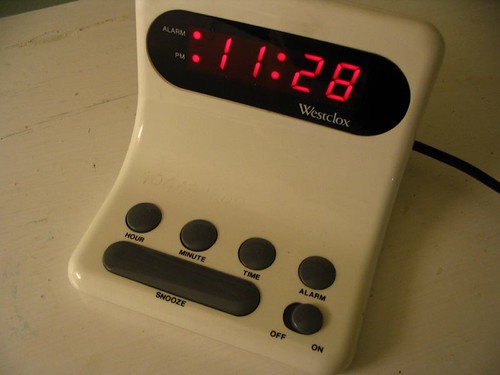
Where is `white wooden nightstand`? white wooden nightstand is located at coordinates (55, 194).